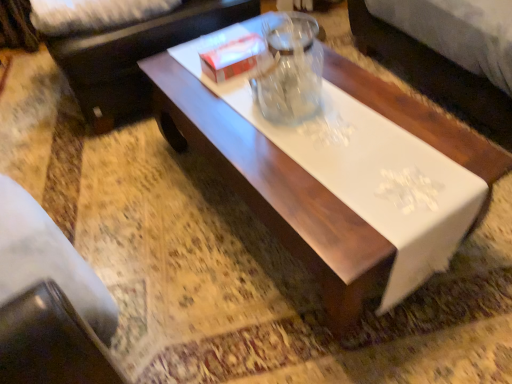
The width and height of the screenshot is (512, 384). Identify the location of vacant space to the left of white cardboard box at center. (179, 76).